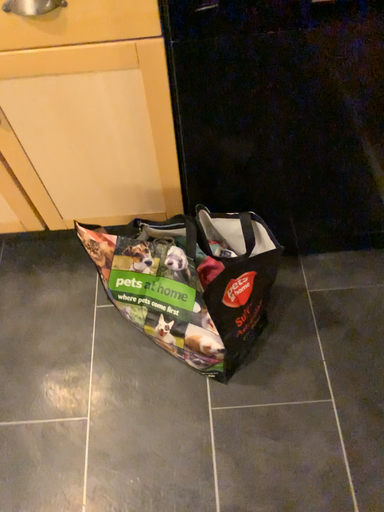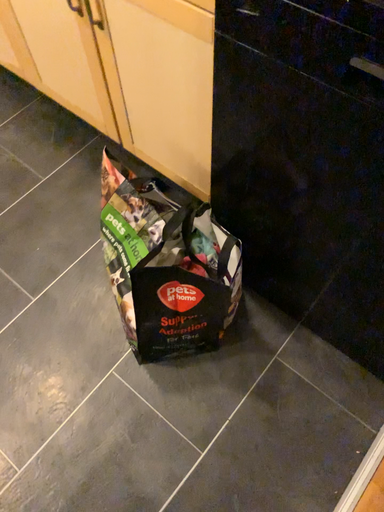
Question: Which way did the camera rotate in the video?

Choices:
 (A) rotated left
 (B) rotated right

Answer: (A)